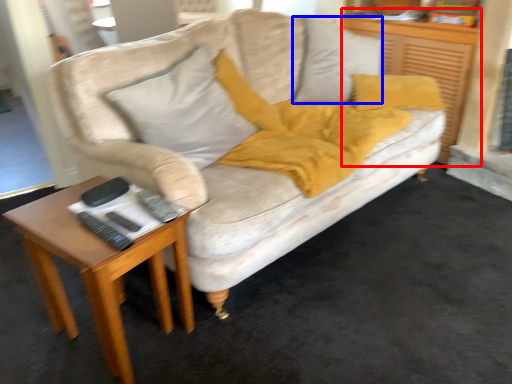
Question: Which object is further to the camera taking this photo, dresser (highlighted by a red box) or pillow (highlighted by a blue box)?

Choices:
 (A) dresser
 (B) pillow

Answer: (A)